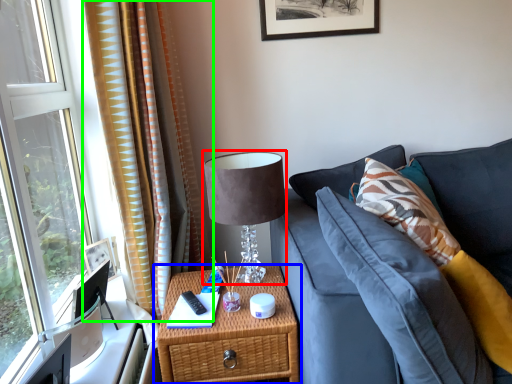
Question: Which is nearer to the table lamp (highlighted by a red box)? nightstand (highlighted by a blue box) or curtain (highlighted by a green box).

Choices:
 (A) nightstand
 (B) curtain

Answer: (A)